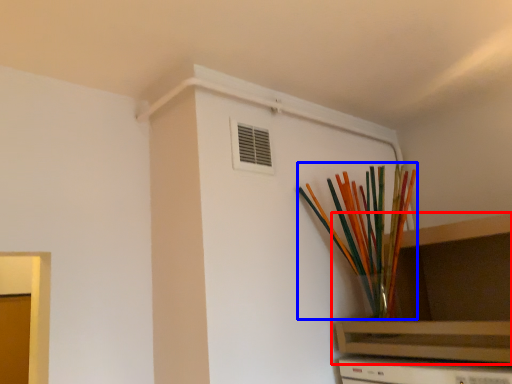
Question: Among these objects, which one is farthest to the camera, shelf (highlighted by a red box) or paint brush (highlighted by a blue box)?

Choices:
 (A) shelf
 (B) paint brush

Answer: (B)